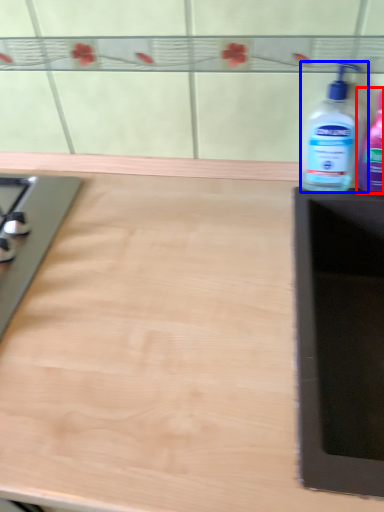
Question: Which object appears closest to the camera in this image, bottle (highlighted by a red box) or bottle (highlighted by a blue box)?

Choices:
 (A) bottle
 (B) bottle

Answer: (A)